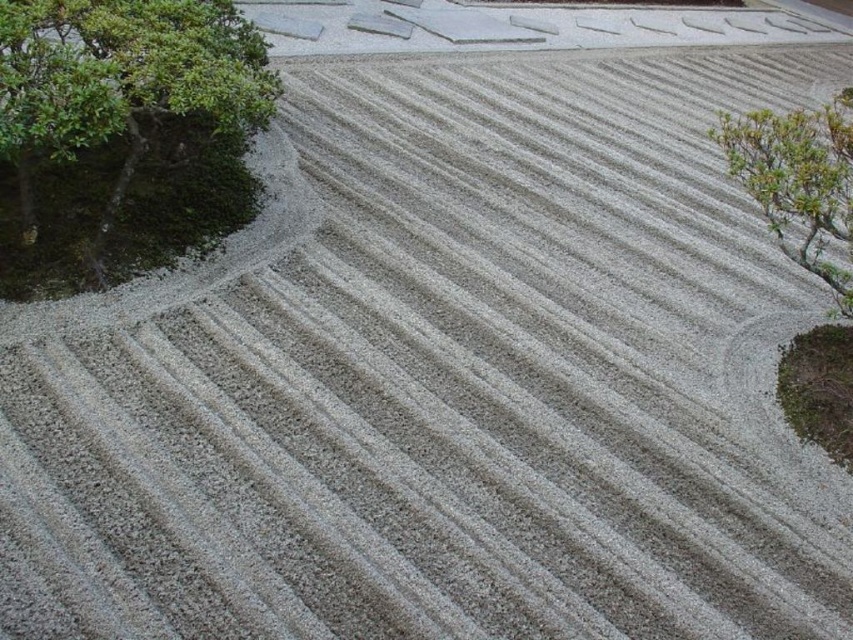
Does point (131, 122) come closer to viewer compared to point (767, 160)?

No.

You are a GUI agent. You are given a task and a screenshot of the screen. Output one action in this format:
    pyautogui.click(x=<x>, y=<y>)
    Task: Click on the green leafy tree at upper left
    This screenshot has width=853, height=640.
    Given the screenshot: What is the action you would take?
    [122, 134]